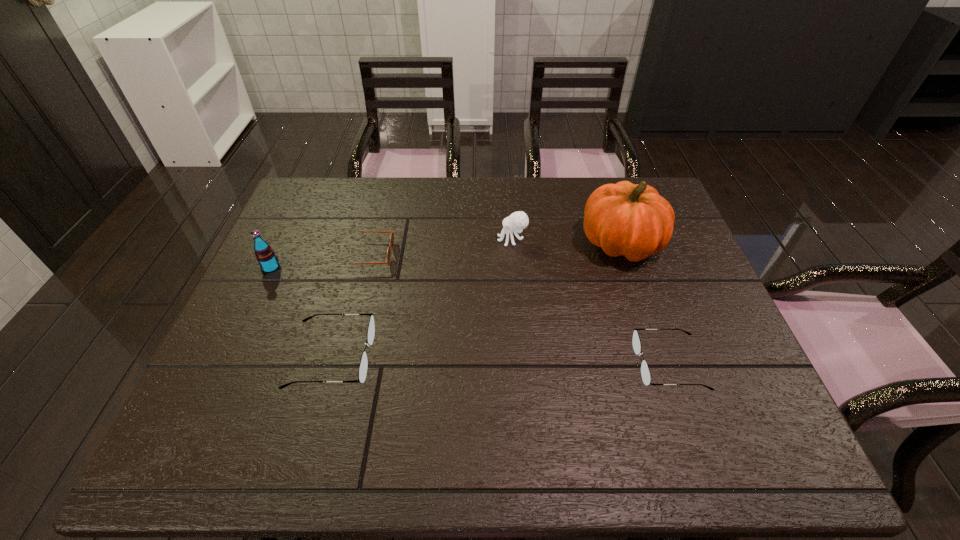
Locate an element on the screen. This screenshot has width=960, height=540. spot to insert another spectacles for uniform distribution is located at coordinates tap(499, 360).